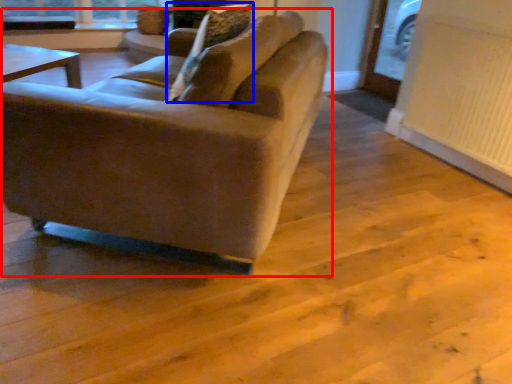
Question: Which object is further to the camera taking this photo, studio couch (highlighted by a red box) or pillow (highlighted by a blue box)?

Choices:
 (A) studio couch
 (B) pillow

Answer: (B)